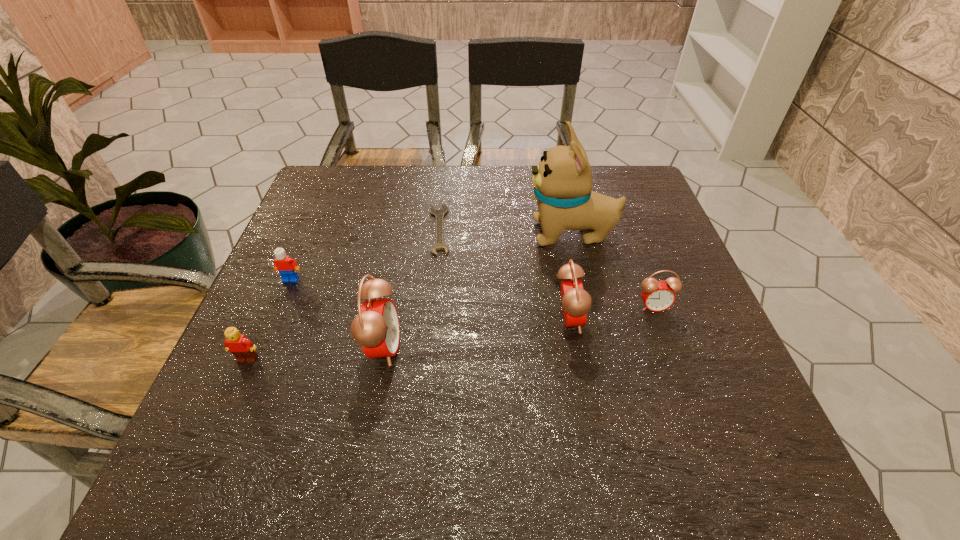
Choose which alarm clock is the third nearest neighbor to the wrench. Please provide its 2D coordinates. Your answer should be formatted as a tuple, i.e. [(x, y)], where the tuple contains the x and y coordinates of a point satisfying the conditions above.

[(657, 296)]

Where is `alarm clock that is the nearest to the second shortest alarm clock`? The image size is (960, 540). alarm clock that is the nearest to the second shortest alarm clock is located at coordinates (657, 296).

Locate an element on the screen. The height and width of the screenshot is (540, 960). free space that satisfies the following two spatial constraints: 1. on the clock face of the shortest alarm clock; 2. on the clock face of the leftmost alarm clock is located at coordinates (668, 347).

Where is `free location that satisfies the following two spatial constraints: 1. on the clock face of the second tallest alarm clock; 2. on the face of the nearer Lego`? The height and width of the screenshot is (540, 960). free location that satisfies the following two spatial constraints: 1. on the clock face of the second tallest alarm clock; 2. on the face of the nearer Lego is located at coordinates (576, 359).

Where is `free point that satisfies the following two spatial constraints: 1. on the face of the tallest object; 2. on the face of the nearer Lego`? free point that satisfies the following two spatial constraints: 1. on the face of the tallest object; 2. on the face of the nearer Lego is located at coordinates (601, 359).

Locate an element on the screen. This screenshot has width=960, height=540. free space that satisfies the following two spatial constraints: 1. on the face of the puppy; 2. on the face of the nearer Lego is located at coordinates point(601,359).